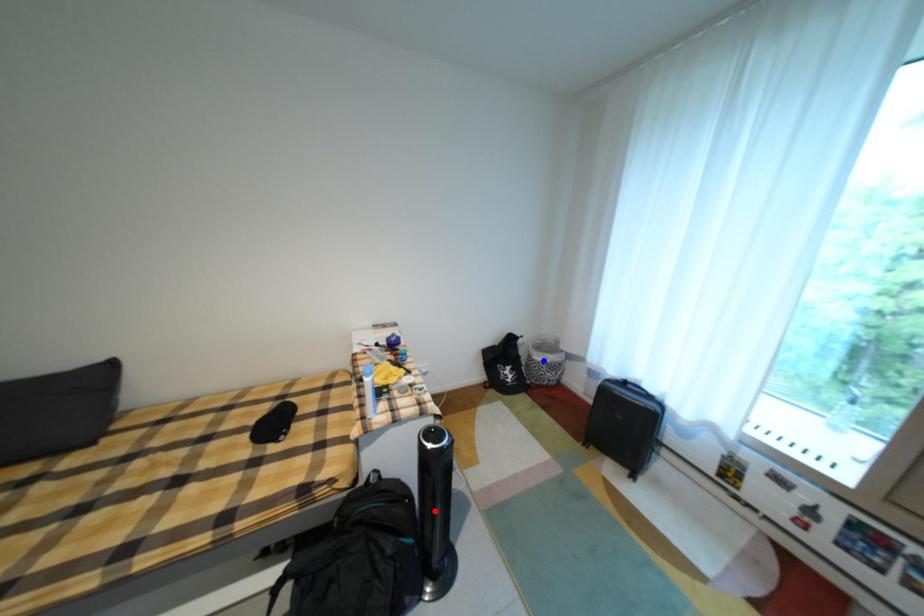
Question: Which of the two points in the image is closer to the camera?

Choices:
 (A) Blue point is closer.
 (B) Red point is closer.

Answer: (B)